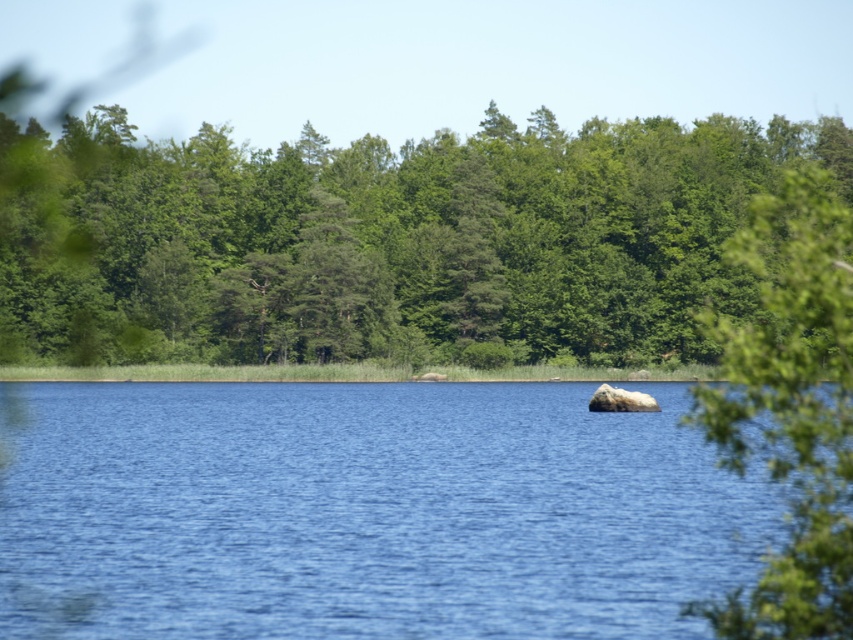
You are standing at the edge of the water and see two points marked in the scene. The first point is at coordinates point (352, 221) and the second point is at point (764, 577). Which point is closer to you?

Point (764, 577) is closer to you because point (352, 221) is behind it.

You are standing at the edge of the water and want to walk towards the green leafy trees at center and the green leafy tree at upper right. Which one will you reach first?

You will reach the green leafy trees at center first because it is closer to you than the green leafy tree at upper right.